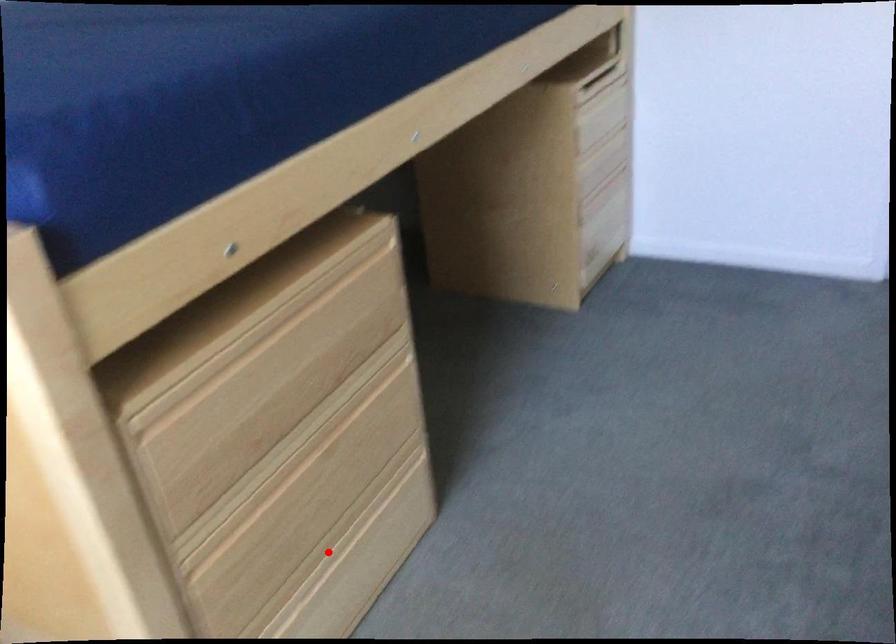
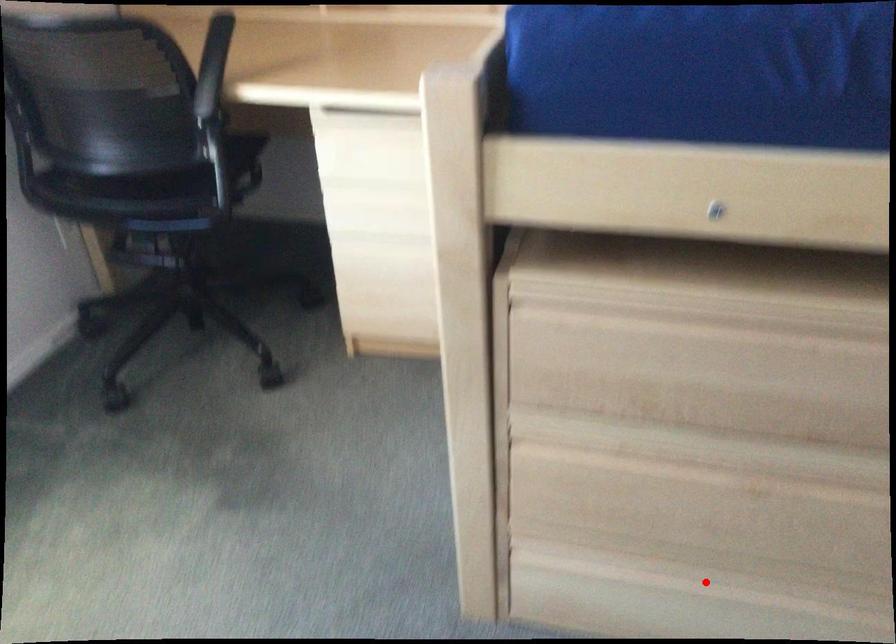
I am providing you with two images of the same scene from different viewpoints. A red point is marked on the first image and another point is marked on the second image. Do the highlighted points in image1 and image2 indicate the same real-world spot?

Yes